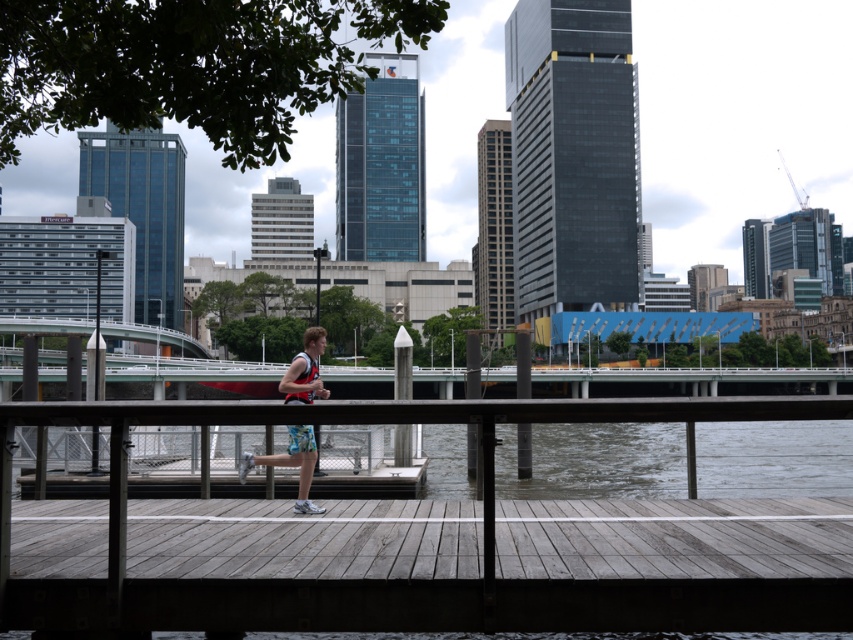
Is wooden dock at center bigger than floral shorts at center?

No, wooden dock at center is not bigger than floral shorts at center.

Does wooden dock at center have a lesser height compared to floral shorts at center?

Yes, wooden dock at center is shorter than floral shorts at center.

This screenshot has height=640, width=853. Describe the element at coordinates (421, 541) in the screenshot. I see `wooden dock at center` at that location.

Where is `wooden dock at center`? The width and height of the screenshot is (853, 640). wooden dock at center is located at coordinates (421, 541).